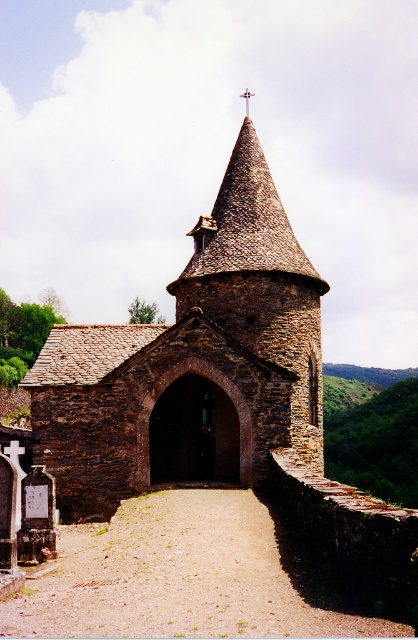
Between rustic stone church at center and metallic cross at upper center, which one has less height?

Standing shorter between the two is metallic cross at upper center.

Can you confirm if rustic stone church at center is positioned to the right of metallic cross at upper center?

Incorrect, rustic stone church at center is not on the right side of metallic cross at upper center.

Between point (288, 417) and point (247, 106), which one is positioned behind?

Point (247, 106)

I want to click on rustic stone church at center, so click(x=193, y=364).